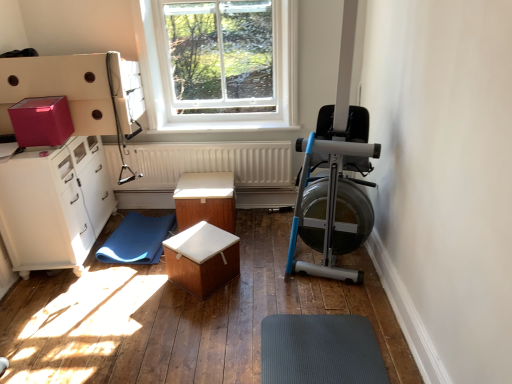
Question: From the image's perspective, would you say wooden box at center, arranged as the second table when viewed from the back, is positioned over wooden box at center, which is the first table from back to front?

Choices:
 (A) no
 (B) yes

Answer: (A)

Question: Is wooden box at center, the first table in the front-to-back sequence, facing away from wooden box at center, the second table when ordered from front to back?

Choices:
 (A) yes
 (B) no

Answer: (B)

Question: Does wooden box at center, arranged as the second table when viewed from the back, appear on the left side of wooden box at center, which is the first table from back to front?

Choices:
 (A) no
 (B) yes

Answer: (A)

Question: From the image's perspective, is wooden box at center, the first table in the front-to-back sequence, located beneath wooden box at center, which is the first table from back to front?

Choices:
 (A) yes
 (B) no

Answer: (A)

Question: Is wooden box at center, arranged as the second table when viewed from the back, positioned before wooden box at center, which is the first table from back to front?

Choices:
 (A) no
 (B) yes

Answer: (B)

Question: Does wooden box at center, arranged as the second table when viewed from the back, appear on the right side of wooden box at center, the second table when ordered from front to back?

Choices:
 (A) no
 (B) yes

Answer: (B)

Question: Is clear glass window at upper center shorter than blue rubber mat at lower left?

Choices:
 (A) yes
 (B) no

Answer: (B)

Question: Considering the relative sizes of clear glass window at upper center and blue rubber mat at lower left in the image provided, is clear glass window at upper center wider than blue rubber mat at lower left?

Choices:
 (A) yes
 (B) no

Answer: (B)

Question: Is clear glass window at upper center completely or partially outside of blue rubber mat at lower left?

Choices:
 (A) yes
 (B) no

Answer: (A)

Question: Does clear glass window at upper center lie behind blue rubber mat at lower left?

Choices:
 (A) no
 (B) yes

Answer: (B)

Question: Can you see clear glass window at upper center touching blue rubber mat at lower left?

Choices:
 (A) yes
 (B) no

Answer: (B)

Question: Is clear glass window at upper center bigger than blue rubber mat at lower left?

Choices:
 (A) no
 (B) yes

Answer: (B)

Question: Is wooden box at center, the first table in the front-to-back sequence, aimed at white textured radiator at center?

Choices:
 (A) yes
 (B) no

Answer: (B)